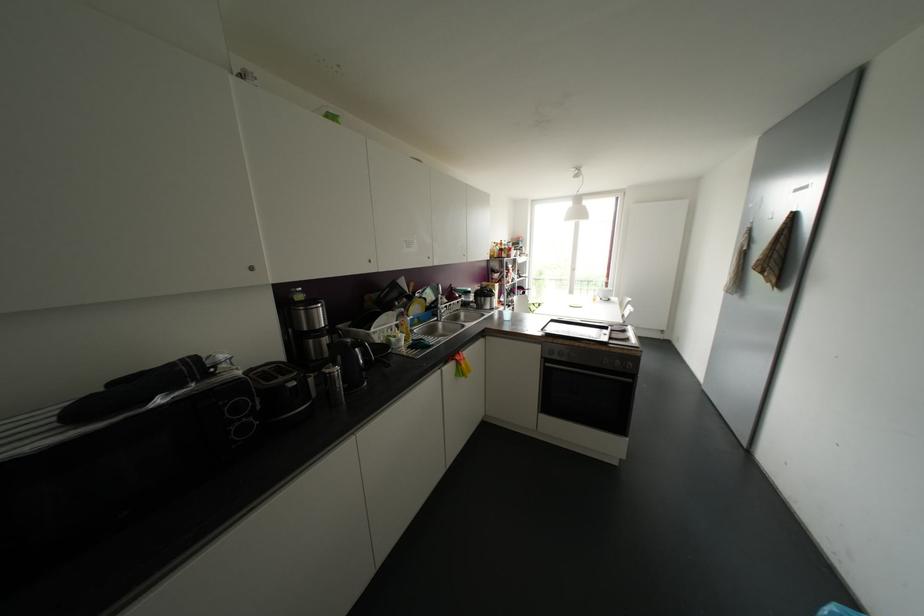
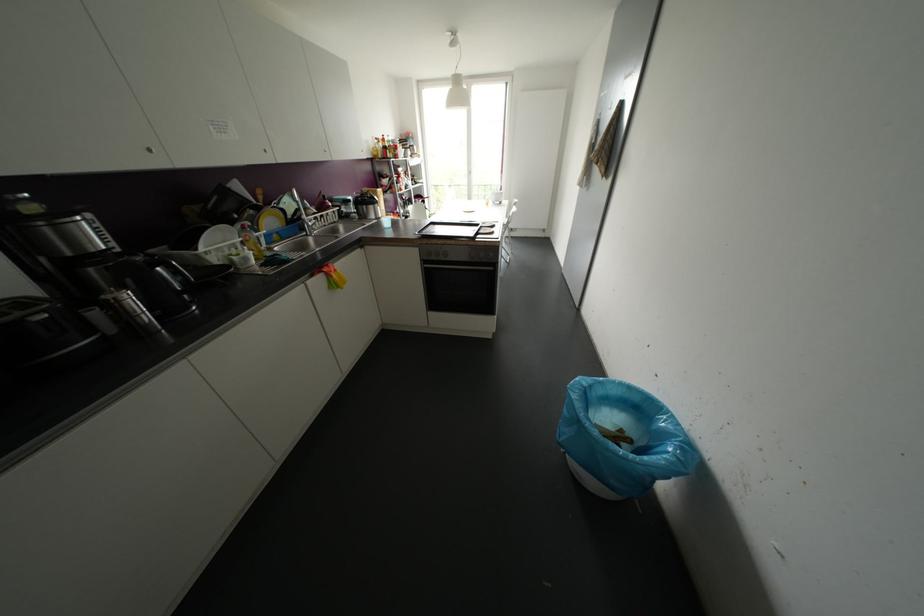
The first image is from the beginning of the video and the second image is from the end. How did the camera likely rotate when shooting the video?

The camera rotated toward right-down.